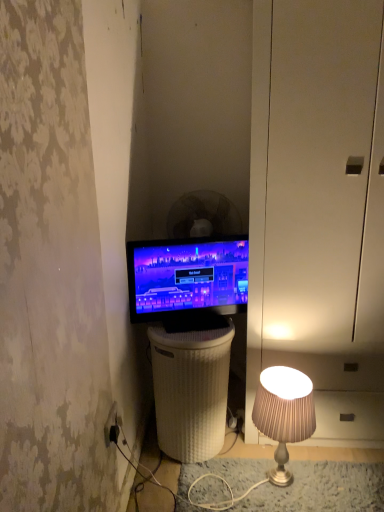
Question: From the image's perspective, is black plastic mechanical fan at center above or below white glossy dresser at right?

Choices:
 (A) below
 (B) above

Answer: (B)

Question: Considering the positions of point (196, 212) and point (379, 72), is point (196, 212) closer or farther from the camera than point (379, 72)?

Choices:
 (A) farther
 (B) closer

Answer: (A)

Question: Is black plastic mechanical fan at center inside the boundaries of white glossy dresser at right, or outside?

Choices:
 (A) outside
 (B) inside

Answer: (A)

Question: From a real-world perspective, is white glossy dresser at right positioned above or below black plastic mechanical fan at center?

Choices:
 (A) above
 (B) below

Answer: (B)

Question: Is point tap(286, 325) closer or farther from the camera than point tap(226, 215)?

Choices:
 (A) closer
 (B) farther

Answer: (A)

Question: In the image, is white glossy dresser at right on the left side or the right side of black plastic mechanical fan at center?

Choices:
 (A) left
 (B) right

Answer: (B)

Question: From the image's perspective, relative to black plastic mechanical fan at center, is white glossy dresser at right above or below?

Choices:
 (A) below
 (B) above

Answer: (A)